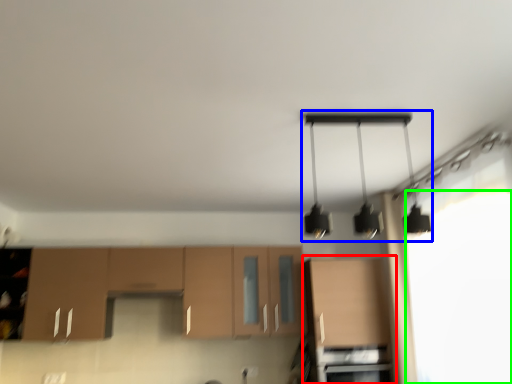
Question: Which is nearer to the cabinetry (highlighted by a red box)? lamp (highlighted by a blue box) or window screen (highlighted by a green box).

Choices:
 (A) lamp
 (B) window screen

Answer: (B)